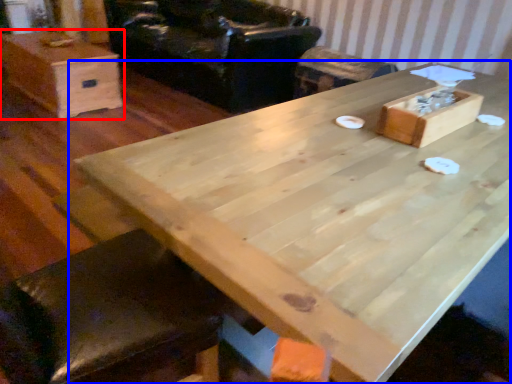
Question: Which of the following is the farthest to the observer, box (highlighted by a red box) or table (highlighted by a blue box)?

Choices:
 (A) box
 (B) table

Answer: (A)